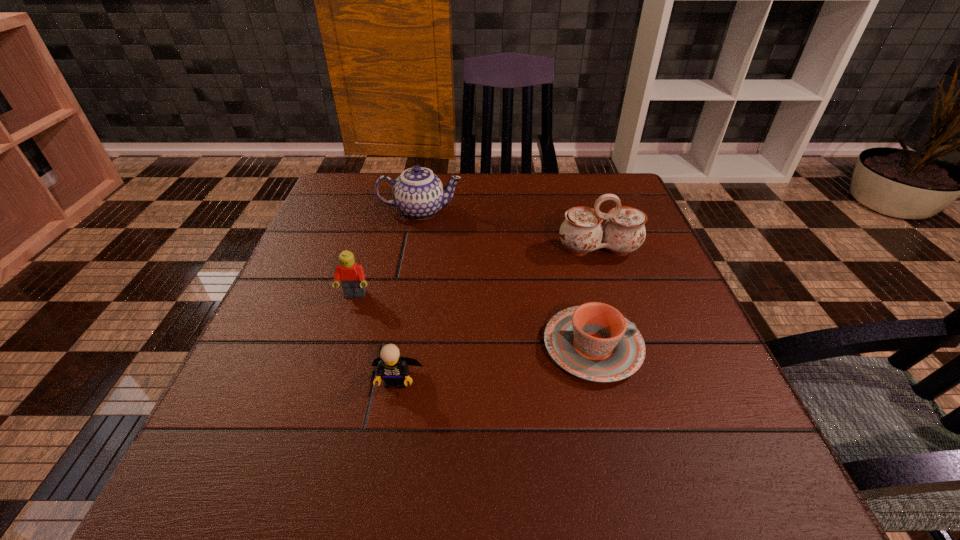
Locate an element on the screen. The height and width of the screenshot is (540, 960). free space located from the spout of the leftmost chinaware is located at coordinates (612, 211).

Locate an element on the screen. vacant space located 0.060m on the face of the left Lego is located at coordinates (346, 324).

Locate an element on the screen. The image size is (960, 540). vacant space situated 0.100m on the front-facing side of the nearer Lego is located at coordinates (384, 451).

Identify the location of vacant space located 0.080m on the handle side of the shortest object. (685, 346).

At what (x,y) coordinates should I click in order to perform the action: click on object that is at the far edge. Please return your answer as a coordinate pair (x, y). Looking at the image, I should click on (418, 193).

This screenshot has width=960, height=540. Identify the location of chinaware present at the left edge. (418, 193).

What are the coordinates of `Lego at the left edge` in the screenshot? It's located at coord(351,275).

Where is `object at the far left corner`? The height and width of the screenshot is (540, 960). object at the far left corner is located at coordinates (418, 193).

Where is `vacant space at the far edge`? vacant space at the far edge is located at coordinates (515, 173).

Image resolution: width=960 pixels, height=540 pixels. Find the location of `vacant area at the left edge`. vacant area at the left edge is located at coordinates (328, 222).